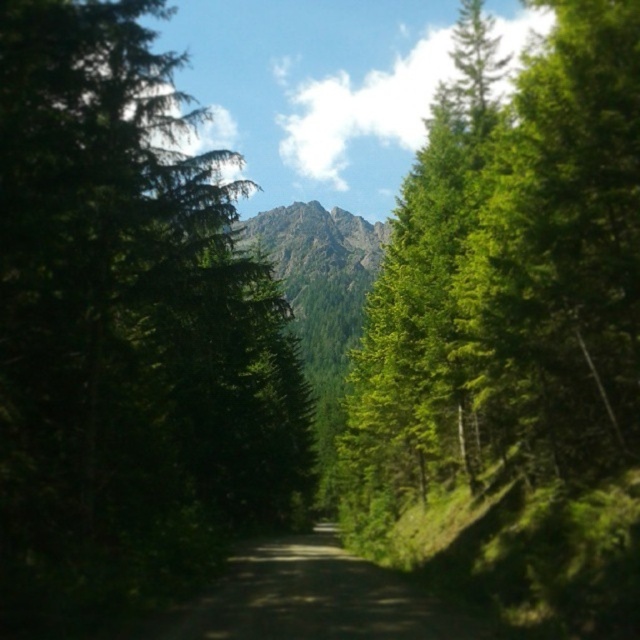
You are a hiker standing at the start of the dirt road at center. You want to take a photo of the green leafy tree at center from the dirt road. Can you fit the entire tree in your camera frame without moving your position?

The green leafy tree at center is larger in size than the dirt road at center. Since the tree is larger than the road, it might not fit entirely in the camera frame from your current position on the dirt road at center.

You are standing on the forest path and see the point marked at coordinates (509, 284). What is the object located at this point?

The point at coordinates (509, 284) corresponds to the green leafy tree at center.